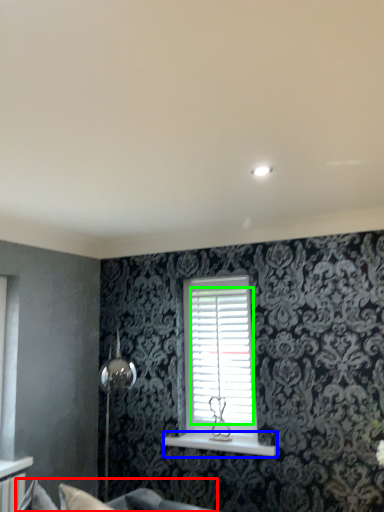
Question: Which object is positioned closest to couch (highlighted by a red box)? Select from window sill (highlighted by a blue box) and shutter (highlighted by a green box).

Choices:
 (A) window sill
 (B) shutter

Answer: (A)